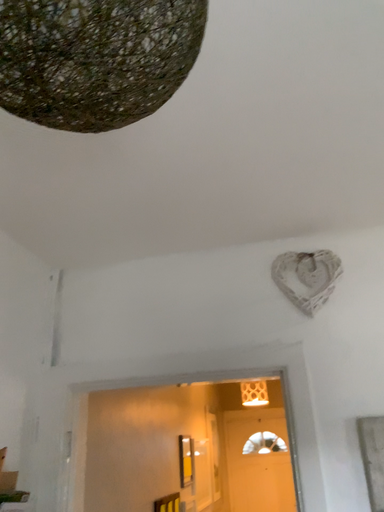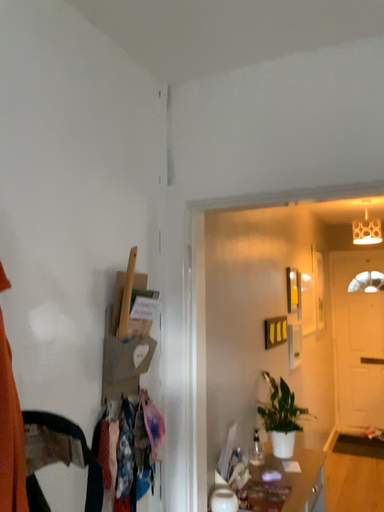
Question: How did the camera likely rotate when shooting the video?

Choices:
 (A) rotated left
 (B) rotated right

Answer: (A)